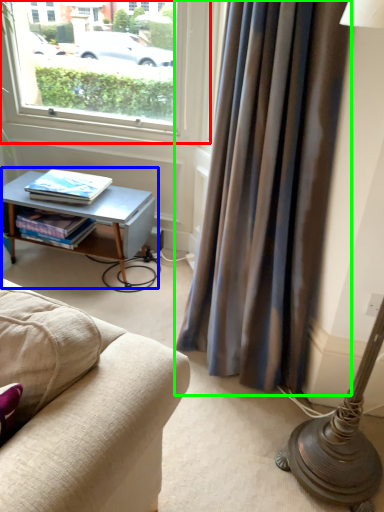
Question: Estimate the real-world distances between objects in this image. Which object is closer to window (highlighted by a red box), table (highlighted by a blue box) or curtain (highlighted by a green box)?

Choices:
 (A) table
 (B) curtain

Answer: (A)